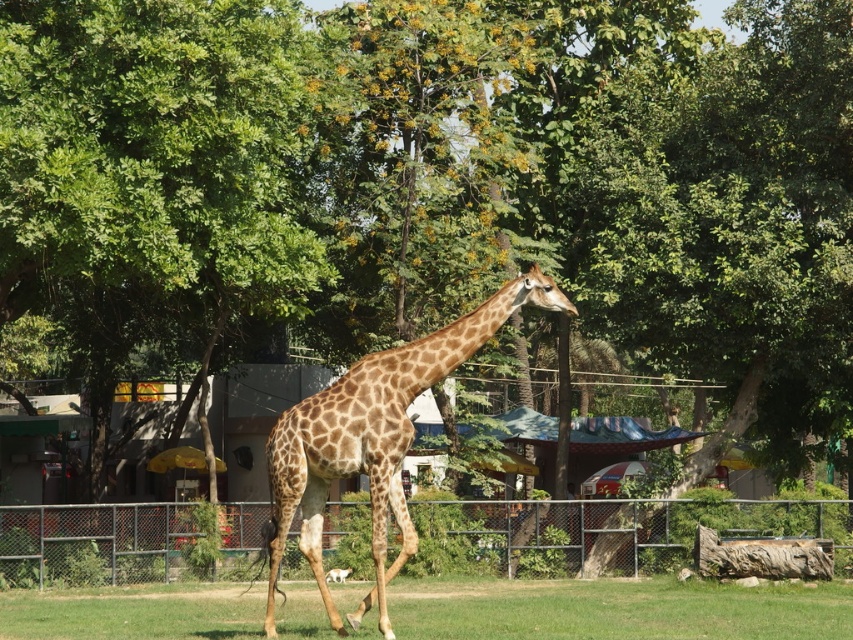
Who is positioned more to the left, green grass at lower center or spotted fur giraffe at center?

From the viewer's perspective, spotted fur giraffe at center appears more on the left side.

Does green grass at lower center appear on the right side of spotted fur giraffe at center?

Indeed, green grass at lower center is positioned on the right side of spotted fur giraffe at center.

Identify the location of green grass at lower center. This screenshot has height=640, width=853. (618, 609).

Is point (206, 218) farther from viewer compared to point (820, 620)?

Yes, it is.

Is green leafy tree at center bigger than green grass at lower center?

Correct, green leafy tree at center is larger in size than green grass at lower center.

Is point (300, 301) farther from camera compared to point (469, 595)?

Yes, point (300, 301) is farther from viewer.

Image resolution: width=853 pixels, height=640 pixels. Identify the location of green leafy tree at center. click(152, 164).

Does green leafy tree at center have a lesser width compared to spotted fur giraffe at center?

No, green leafy tree at center is not thinner than spotted fur giraffe at center.

Based on the photo, which of these two, green leafy tree at center or spotted fur giraffe at center, stands shorter?

With less height is spotted fur giraffe at center.

Between point (300, 268) and point (274, 480), which one is positioned in front?

Point (274, 480) is more forward.

What are the coordinates of `green leafy tree at center` in the screenshot? It's located at (152, 164).